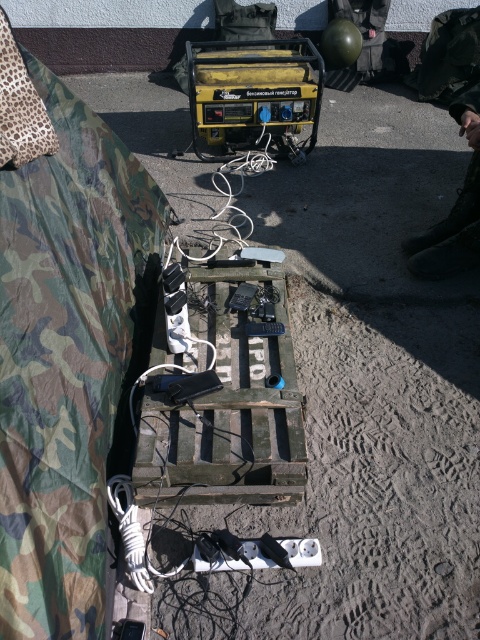
You are setting up a temporary charging station in a disaster area. You have a yellow plastic generator at center and a white cable at center. The generator needs to be positioned so that the cable can reach it without stretching. What is the minimum length of cable required in inches?

The minimum length of cable required is 15.06 inches, as the distance between the yellow plastic generator at center and the white cable at center is exactly 15.06 inches.

You need to plug in a device to the yellow plastic generator at center. Where exactly is the generator positioned in the image?

The yellow plastic generator at center is located at point [252,93].

You are setting up a charging station and need to ensure that the yellow plastic generator at center is not blocking the white cable at center. Based on the scene description, is the generator currently blocking the cable?

The yellow plastic generator at center is positioned over white cable at center, so yes, the generator is blocking the cable.